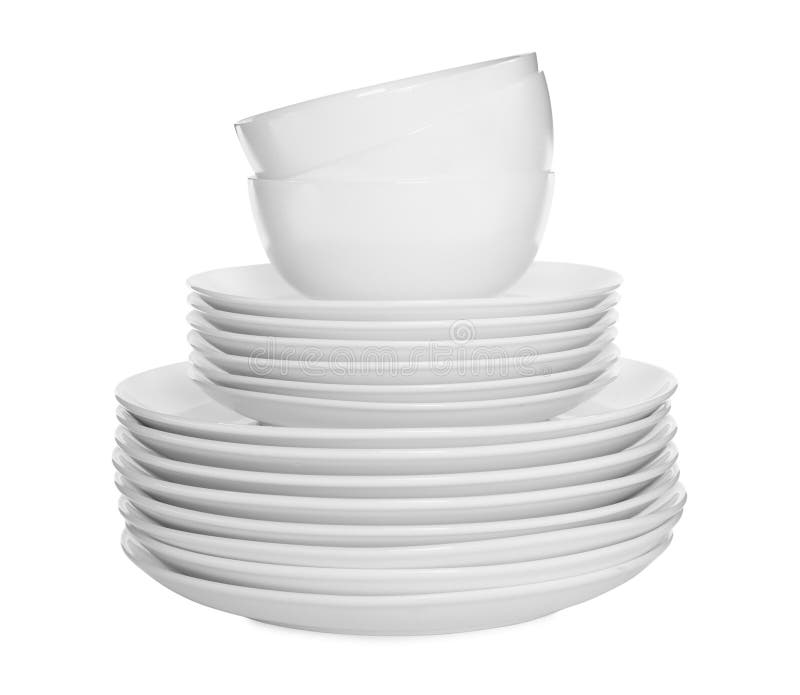
This screenshot has width=800, height=695. Find the location of `saucers`. saucers is located at coordinates (265, 302), (270, 320), (280, 336), (302, 363), (325, 384), (354, 407).